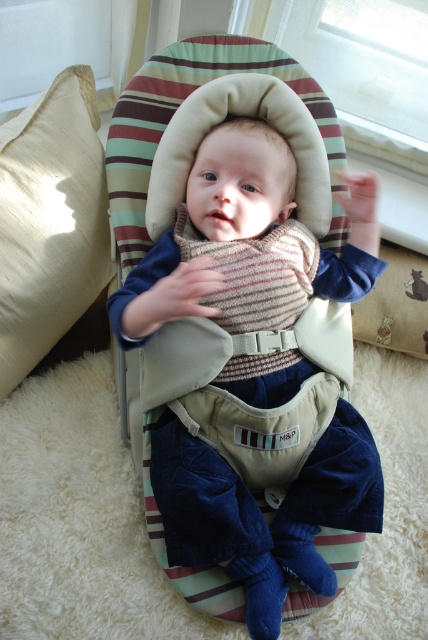
Is striped knit sweater at center to the right of beige fabric pillow at left from the viewer's perspective?

Correct, you'll find striped knit sweater at center to the right of beige fabric pillow at left.

Find the location of a particular element. This screenshot has height=640, width=428. striped knit sweater at center is located at coordinates (244, 243).